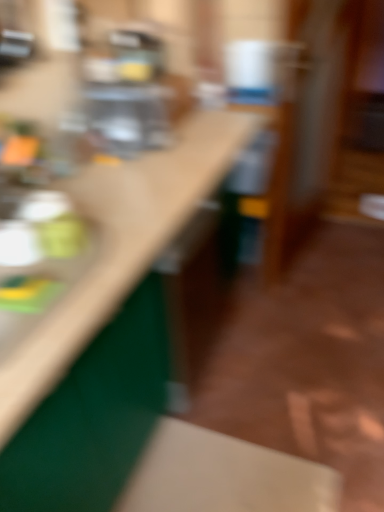
Find the location of a particular element. The height and width of the screenshot is (512, 384). wooden at left is located at coordinates (120, 246).

The width and height of the screenshot is (384, 512). What do you see at coordinates (120, 246) in the screenshot?
I see `wooden at left` at bounding box center [120, 246].

The height and width of the screenshot is (512, 384). Identify the location of wooden at left. (120, 246).